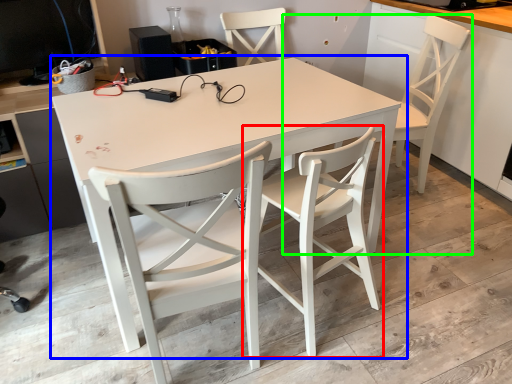
Question: Based on their relative distances, which object is nearer to chair (highlighted by a red box)? Choose from table (highlighted by a blue box) and chair (highlighted by a green box).

Choices:
 (A) table
 (B) chair

Answer: (A)